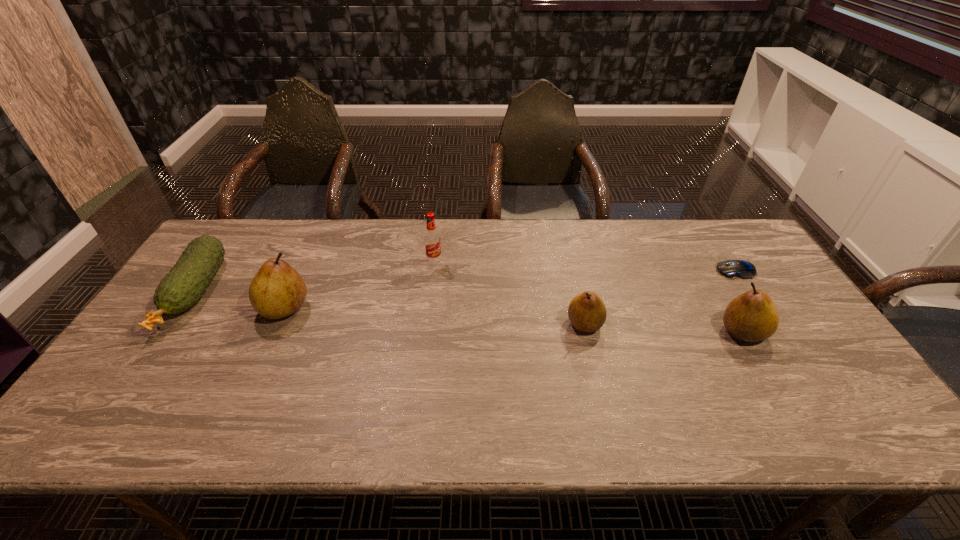
Where is `free region located on the back of the second tallest pear`? This screenshot has width=960, height=540. free region located on the back of the second tallest pear is located at coordinates (719, 291).

Find the location of a particular element. This screenshot has height=540, width=960. vacant space situated 0.290m on the button side of the shortest object is located at coordinates (622, 271).

Where is `vacant space situated on the button side of the shortest object`? vacant space situated on the button side of the shortest object is located at coordinates 599,271.

The width and height of the screenshot is (960, 540). I want to click on blank area located on the button side of the shortest object, so [x=645, y=271].

Image resolution: width=960 pixels, height=540 pixels. In order to click on free space located 0.160m on the front of the third object from left to right in this screenshot , I will do `click(429, 303)`.

Locate an element on the screen. The width and height of the screenshot is (960, 540). vacant space located 0.110m at the blossom end of the second shortest object is located at coordinates (137, 375).

Where is `computer mouse present at the far edge`? The image size is (960, 540). computer mouse present at the far edge is located at coordinates (742, 269).

Find the location of a particular element. Image resolution: width=960 pixels, height=540 pixels. root beer present at the far edge is located at coordinates (432, 242).

At what (x,y) coordinates should I click in order to perform the action: click on cucumber located in the far edge section of the desktop. Please return your answer as a coordinate pair (x, y). Looking at the image, I should click on (182, 287).

Find the location of a particular element. This screenshot has height=540, width=960. object at the left edge is located at coordinates (182, 287).